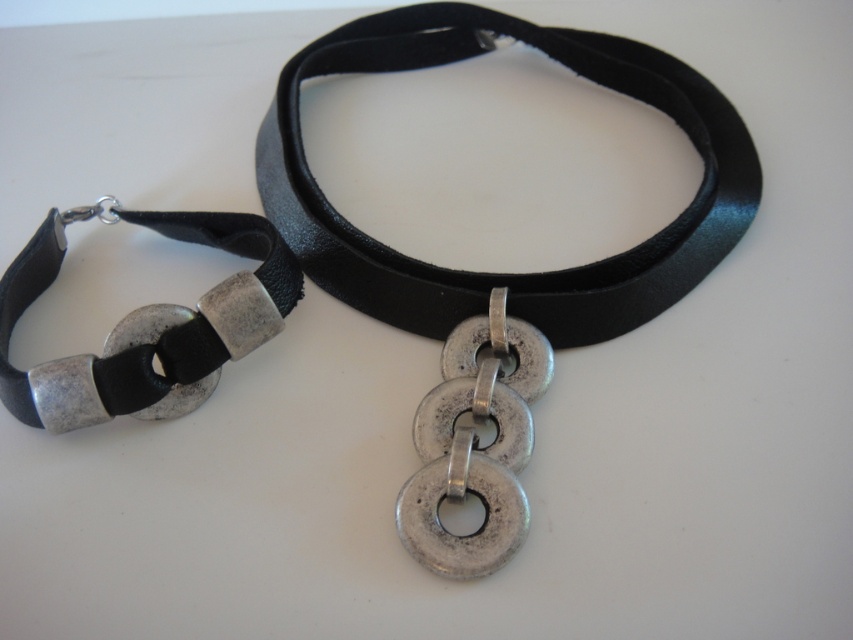
You are a jewelry designer examining the black leather choker at center and the silver metallic chain at center in the image. Which object occupies more vertical space in the scene?

The black leather choker at center has a greater height compared to the silver metallic chain at center, so it occupies more vertical space.

You are a jewelry designer examining the black leather strap at left and the silver metallic chain at center in the image. Which object is closer to you?

The black leather strap at left is closer to you because it is positioned further to the viewer than the silver metallic chain at center.

You are an assistant who needs to describe the location of the black leather strap at left in the image. What are its coordinates?

The coordinates of the black leather strap at left are at point (148, 323).